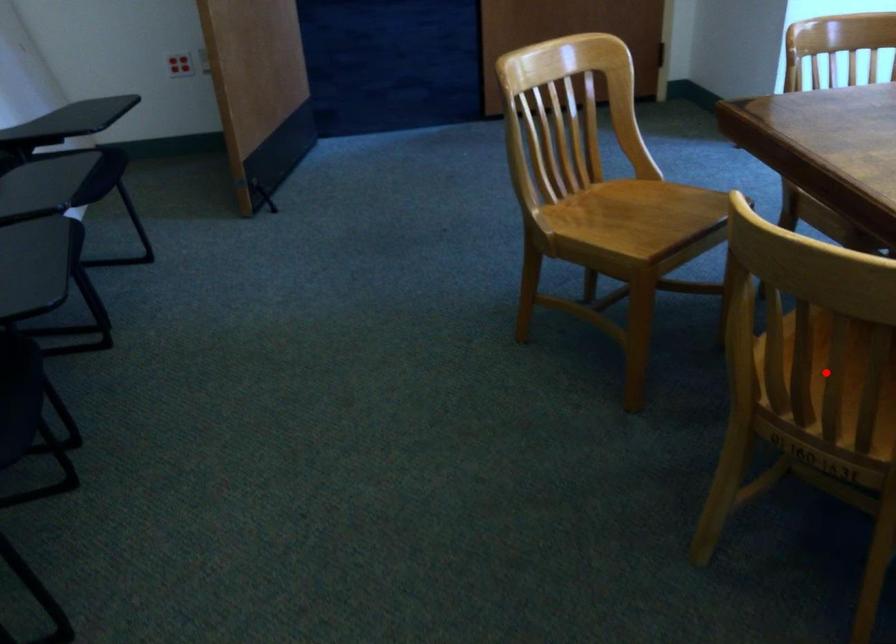
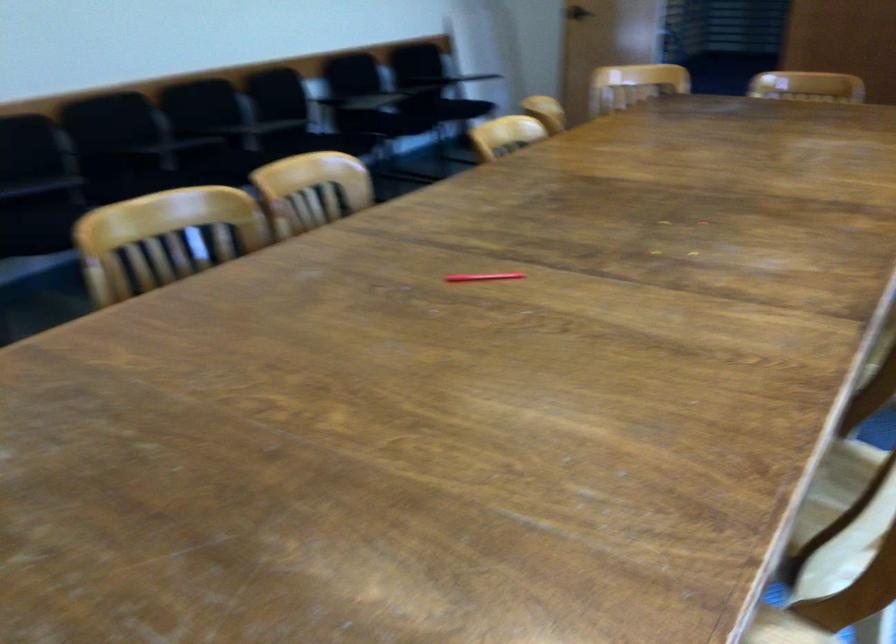
Question: I am providing you with two images of the same scene from different viewpoints. A red point is marked on the first image. At the location where the point appears in image 1, is it still visible in image 2?

Choices:
 (A) Yes
 (B) No

Answer: (B)